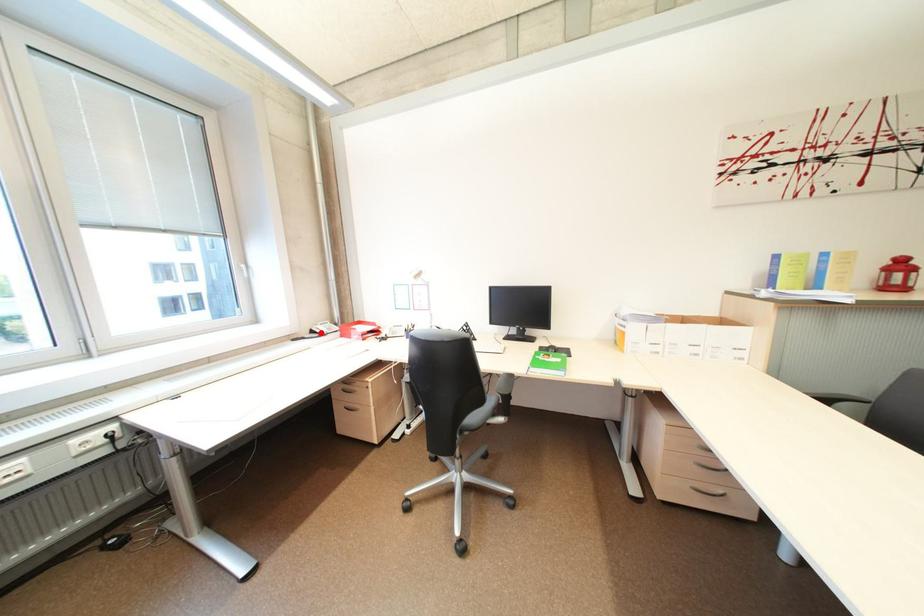
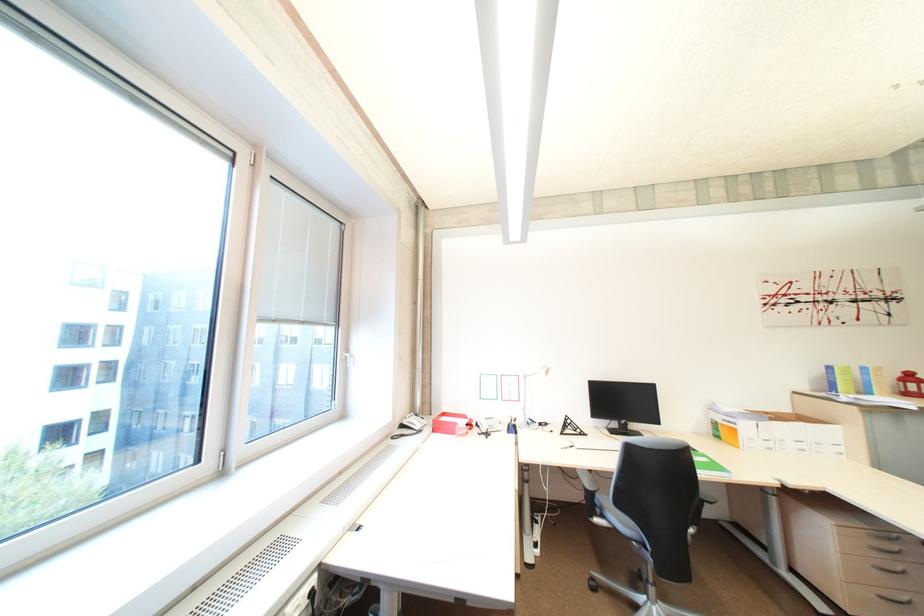
Find the pixel in the second image that matches the highlighted location in the first image.

(410, 427)